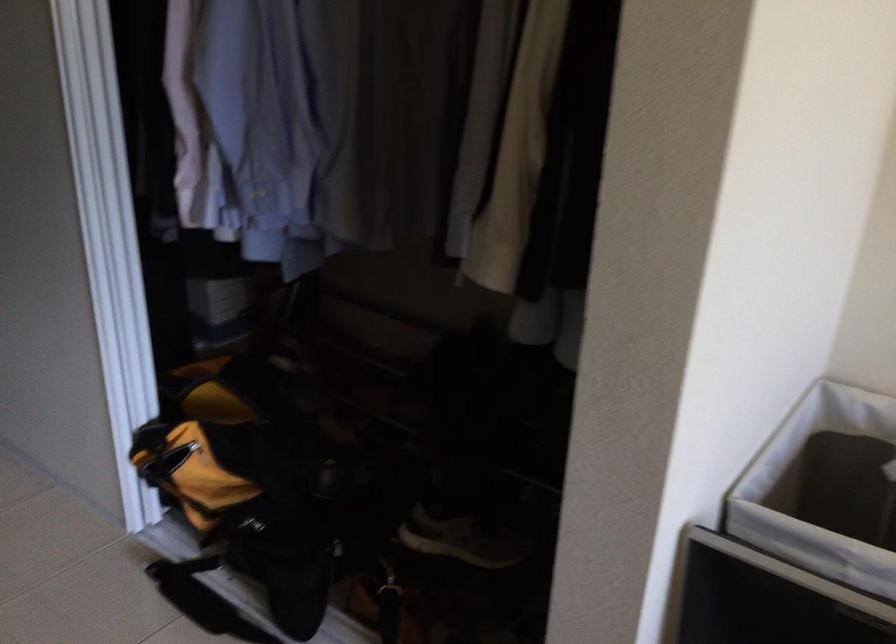
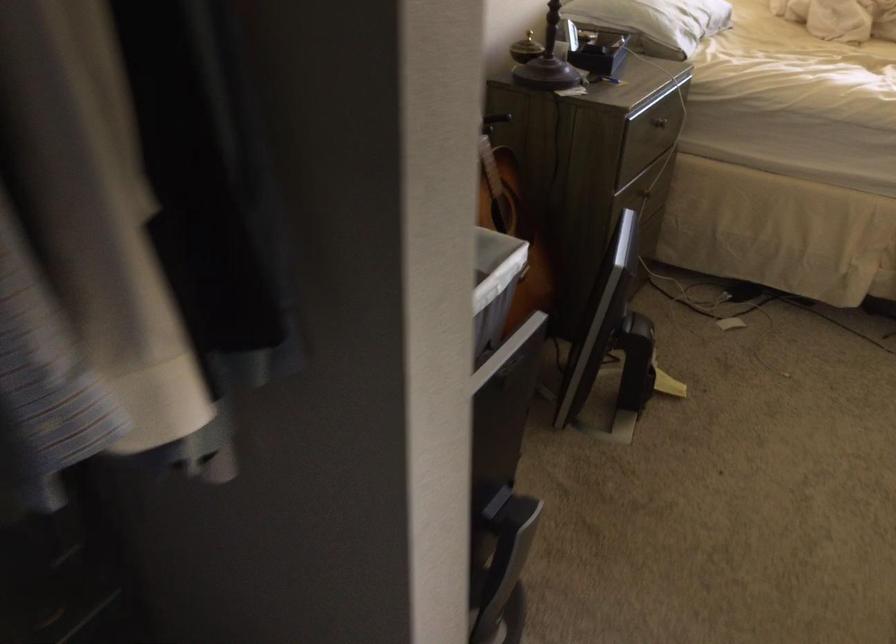
In the scene shown: First-person continuous shooting, in which direction is the camera rotating?

The camera's rotation is toward right-down.